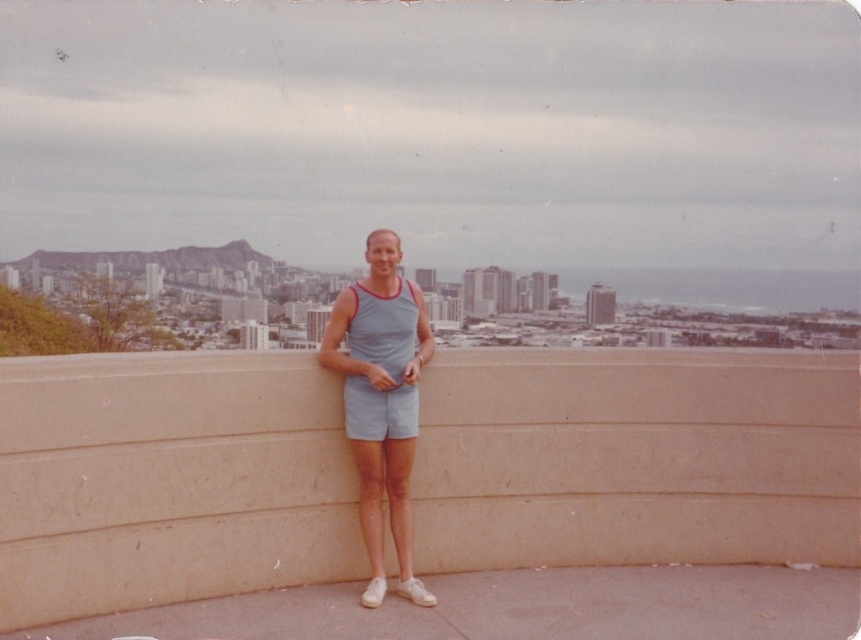
In the scene shown: You are a delivery person who needs to place a small package on a surface in the image. Which object from the beige concrete ledge at center and gray fabric shorts at center would be more suitable for placing the package?

The beige concrete ledge at center is larger in size than the gray fabric shorts at center, so the beige concrete ledge at center is more suitable for placing the small package.

You are a photographer trying to capture a candid shot of the man in the scene. You notice the beige concrete ledge at center and the gray fabric shorts at center. Which object is positioned higher in the frame?

The beige concrete ledge at center is positioned higher than the gray fabric shorts at center in the frame.